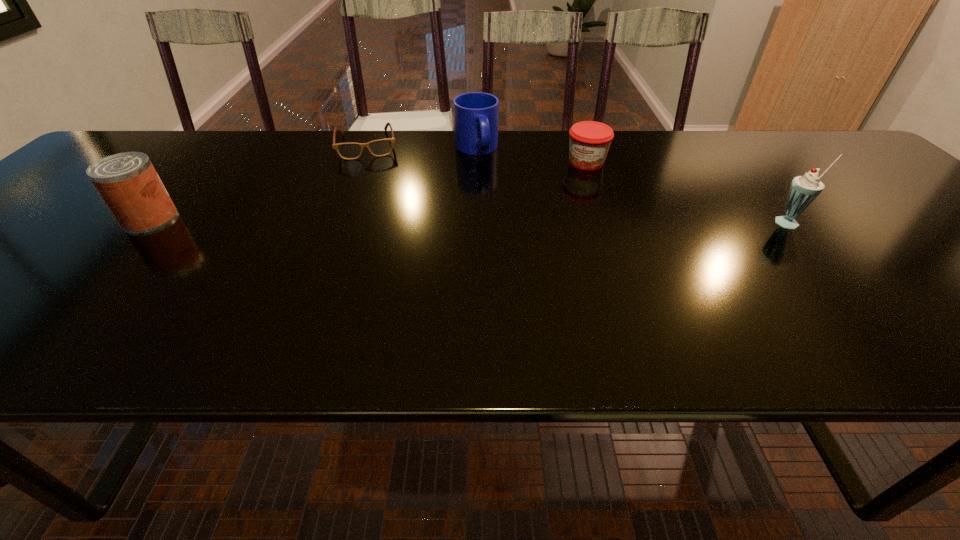
Locate an element on the screen. The width and height of the screenshot is (960, 540). vacant position located on the side with the handle of the mug is located at coordinates (487, 175).

In order to click on vacant area situated 0.090m on the side with the handle of the mug in this screenshot , I will do 490,181.

The width and height of the screenshot is (960, 540). Find the location of `free space located 0.120m on the front-facing side of the shortest object`. free space located 0.120m on the front-facing side of the shortest object is located at coordinates (372, 184).

Locate an element on the screen. The image size is (960, 540). vacant space located 0.050m on the front-facing side of the shortest object is located at coordinates (371, 170).

This screenshot has width=960, height=540. Find the location of `vacant region located on the front-facing side of the shortest object`. vacant region located on the front-facing side of the shortest object is located at coordinates (375, 216).

Where is `vacant space located on the label side of the second shortest object`? vacant space located on the label side of the second shortest object is located at coordinates (556, 215).

Find the location of a particular element. This screenshot has height=540, width=960. vacant area situated 0.120m on the label side of the second shortest object is located at coordinates (567, 195).

I want to click on free space located 0.360m on the label side of the second shortest object, so click(x=533, y=254).

The width and height of the screenshot is (960, 540). Identify the location of mug that is at the far edge. (476, 114).

Where is `spectacles at the far edge`? spectacles at the far edge is located at coordinates (349, 151).